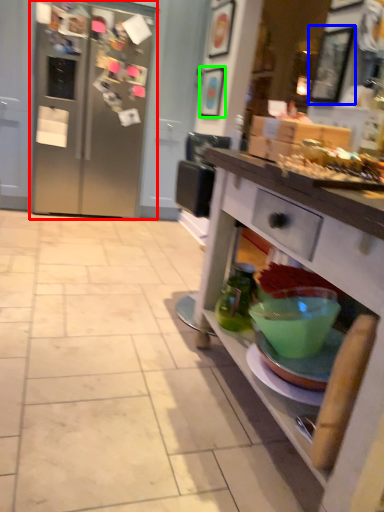
Question: Considering the real-world distances, which object is closest to refrigerator (highlighted by a red box)? picture frame (highlighted by a blue box) or picture frame (highlighted by a green box).

Choices:
 (A) picture frame
 (B) picture frame

Answer: (B)